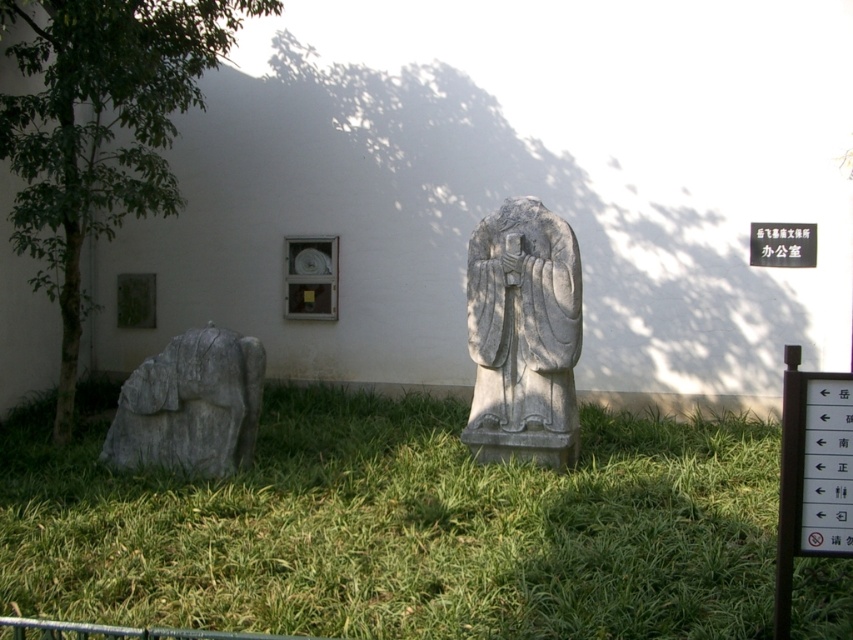
You are a visitor looking at the green grass at center and the white paper sign at upper center in the scene. Which object is closer to you?

The green grass at center is closer to you because it is in front of the white paper sign at upper center.